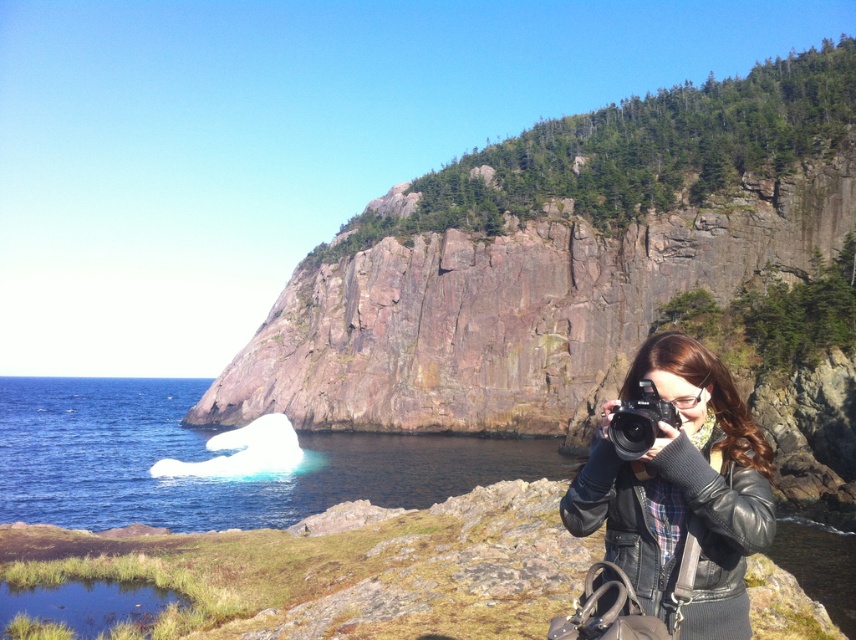
Question: Is brown rock cliff at center smaller than white ice at lower left?

Choices:
 (A) yes
 (B) no

Answer: (A)

Question: Which object is positioned farthest from the black plastic camera at lower right?

Choices:
 (A) white ice at lower left
 (B) black leather jacket at lower right
 (C) brown rock cliff at center

Answer: (C)

Question: Does brown rock cliff at center appear on the left side of white ice at lower left?

Choices:
 (A) yes
 (B) no

Answer: (B)

Question: Is brown rock cliff at center to the left of white ice at lower left from the viewer's perspective?

Choices:
 (A) no
 (B) yes

Answer: (A)

Question: Which of the following is the farthest from the observer?

Choices:
 (A) (622, 410)
 (B) (722, 525)
 (C) (830, 220)

Answer: (C)

Question: Which of these objects is positioned closest to the black leather jacket at lower right?

Choices:
 (A) white ice at lower left
 (B) brown rock cliff at center
 (C) black plastic camera at lower right

Answer: (C)